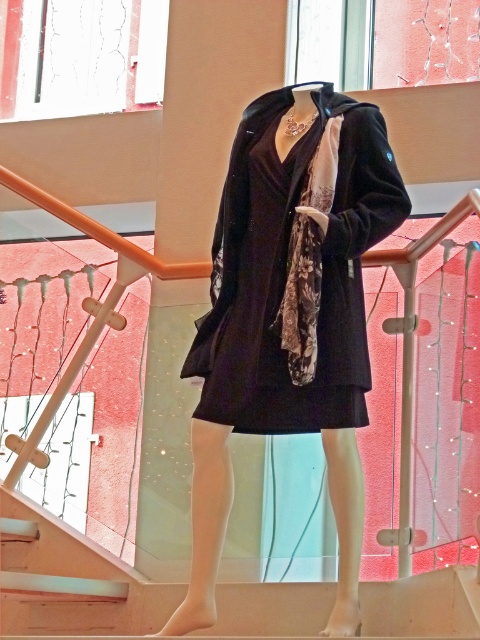
Based on the photo, does velvet black coat at center appear under white glossy stairs at lower center?

No.

Which is behind, point (225, 438) or point (471, 632)?

Positioned behind is point (225, 438).

What are the coordinates of `velvet black coat at center` in the screenshot? It's located at (289, 314).

At what (x,y) coordinates should I click in order to perform the action: click on velvet black coat at center. Please return your answer as a coordinate pair (x, y). Image resolution: width=480 pixels, height=640 pixels. Looking at the image, I should click on (289, 314).

Between point (121, 598) and point (315, 248), which one is positioned in front?

Point (315, 248) is more forward.

Which is more to the left, white glossy stairs at lower center or floral silk scarf at center?

Answer: Positioned to the left is white glossy stairs at lower center.

Is point (430, 582) behind point (298, 280)?

Yes.

You are a GUI agent. You are given a task and a screenshot of the screen. Output one action in this format:
    pyautogui.click(x=<x>, y=<y>)
    Task: Click on the white glossy stairs at lower center
    The width and height of the screenshot is (480, 640).
    Given the screenshot: What is the action you would take?
    pyautogui.click(x=75, y=577)

Which of these two, velvet black coat at center or floral silk scarf at center, stands taller?

With more height is velvet black coat at center.

Is velvet black coat at center taller than floral silk scarf at center?

Yes.

Between point (362, 109) and point (310, 285), which one is positioned behind?

Point (362, 109)

At what (x,y) coordinates should I click in order to perform the action: click on velvet black coat at center. Please return your answer as a coordinate pair (x, y). This screenshot has width=480, height=640. Looking at the image, I should click on (289, 314).